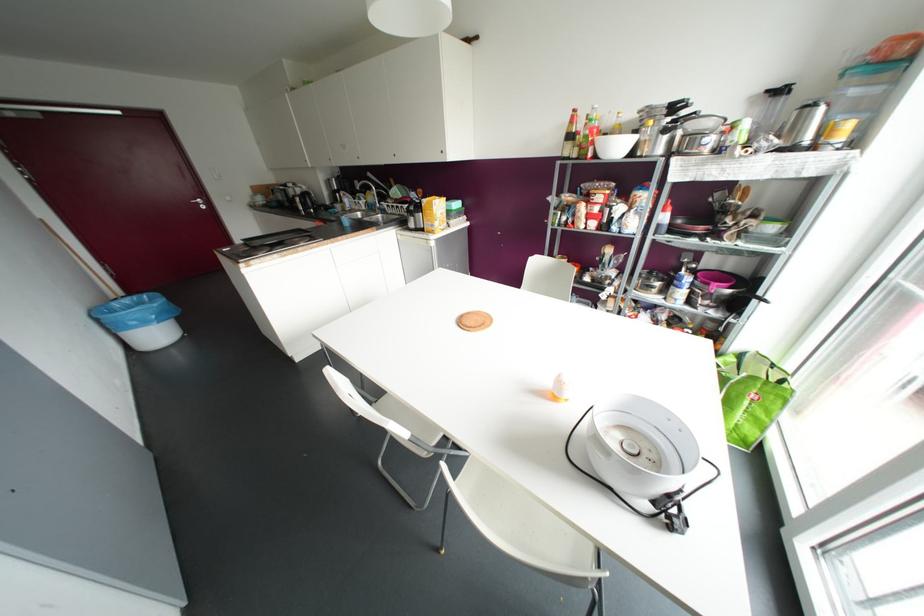
This screenshot has height=616, width=924. Describe the element at coordinates (638, 447) in the screenshot. I see `the silver thermos` at that location.